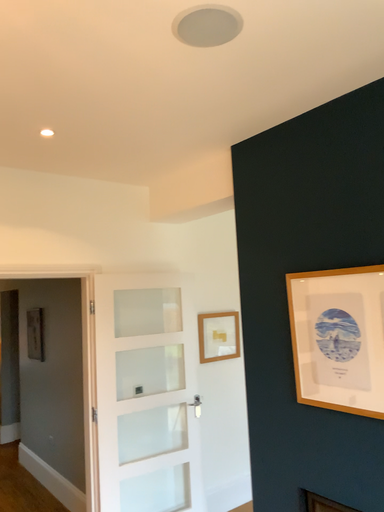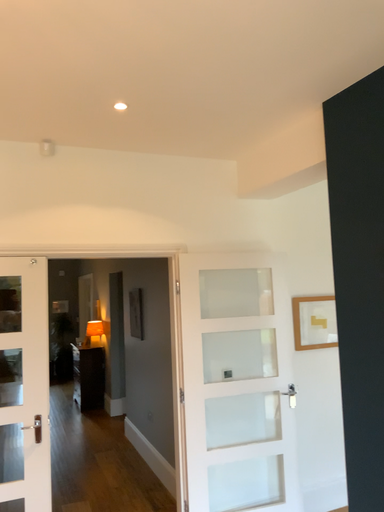
Question: How did the camera likely rotate when shooting the video?

Choices:
 (A) rotated right
 (B) rotated left

Answer: (B)